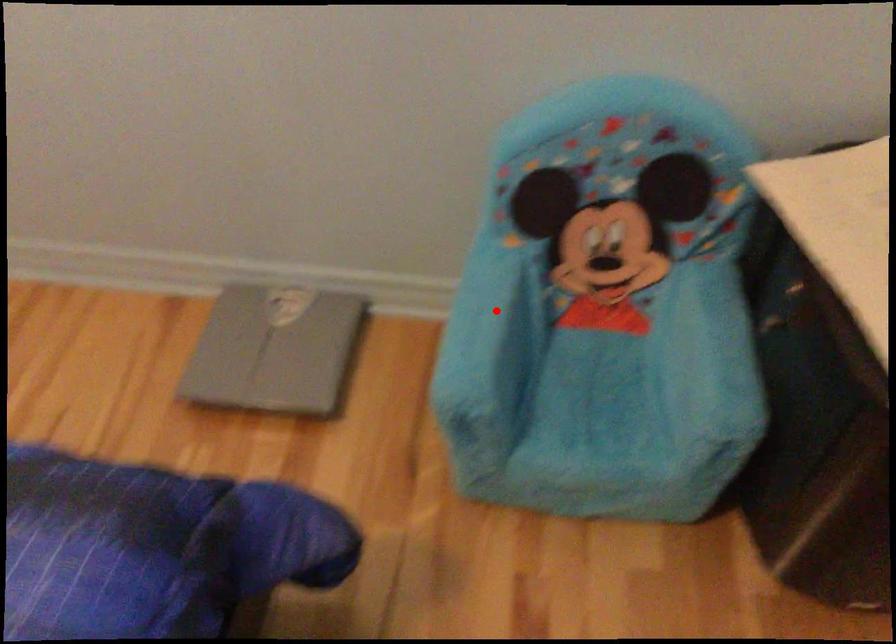
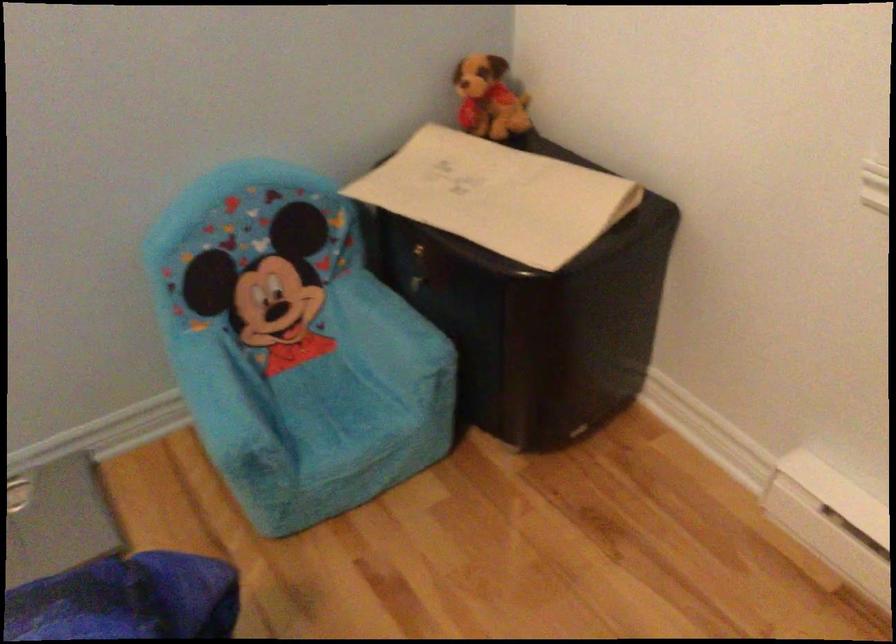
In the second image, find the point that corresponds to the highlighted location in the first image.

(225, 379)